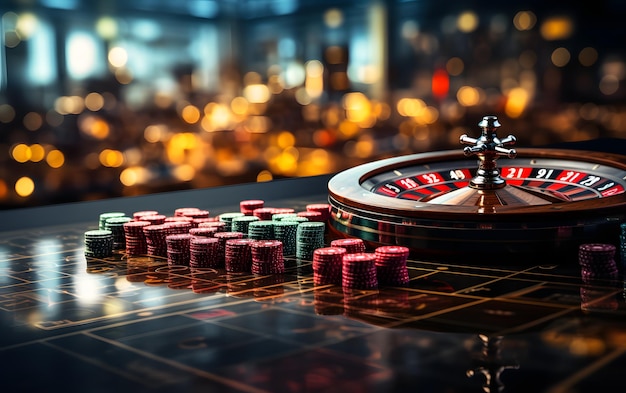
The image size is (626, 393). Identify the location of windows. (48, 64), (74, 64), (364, 53), (212, 57), (145, 56), (297, 56).